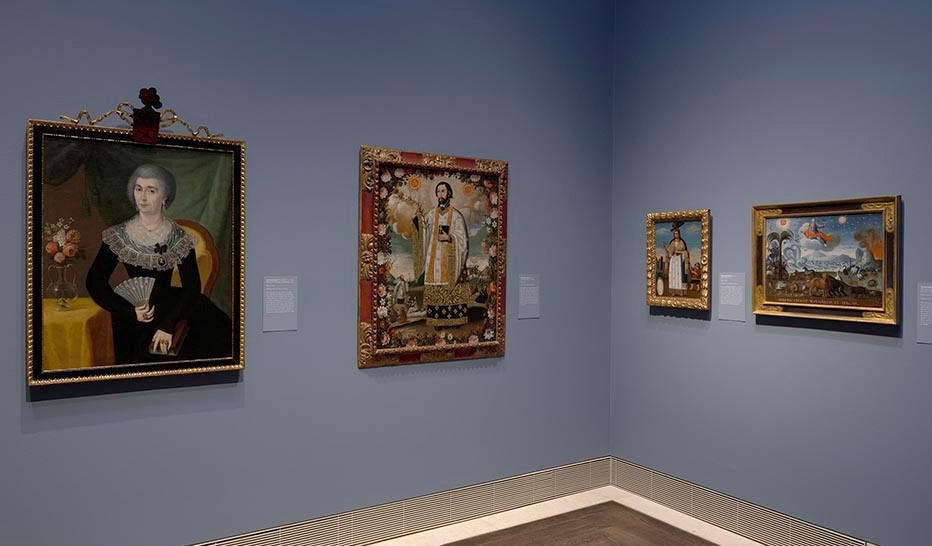
Where is `paintings`? The width and height of the screenshot is (932, 546). paintings is located at coordinates (182, 296), (402, 296), (658, 277), (779, 265).